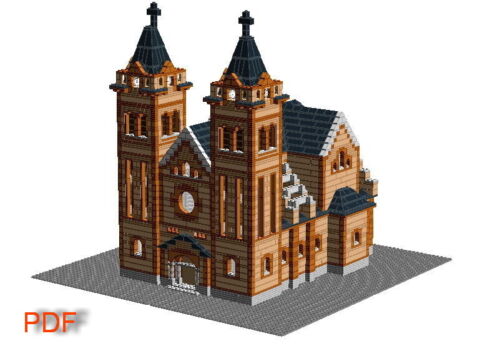
I want to click on pointed pediment, so click(x=184, y=238), click(x=163, y=246), click(x=204, y=252), click(x=183, y=247).